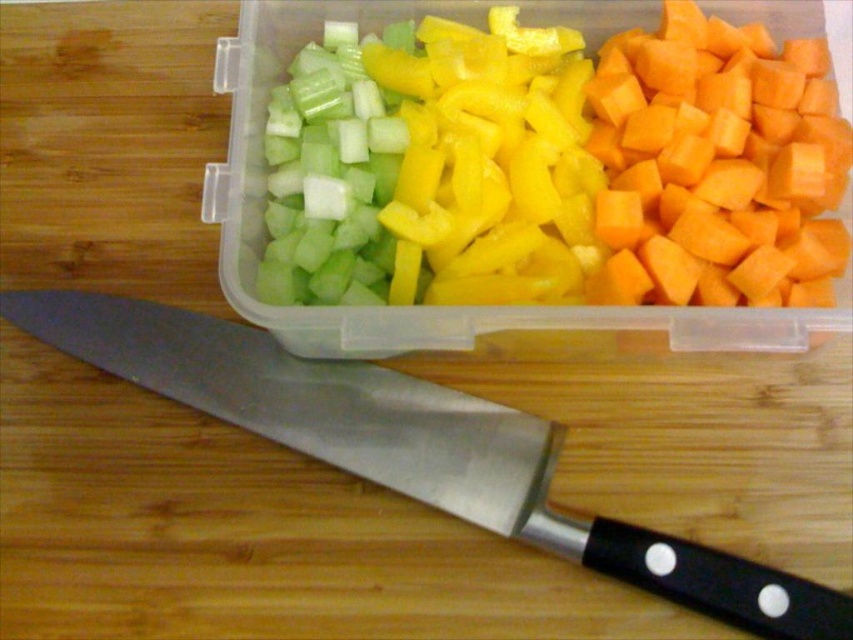
Question: Is orange matte carrot at right bigger than yellow matte bell pepper at center?

Choices:
 (A) no
 (B) yes

Answer: (B)

Question: Does polished metal knife at center appear over green translucent celery at upper left?

Choices:
 (A) no
 (B) yes

Answer: (A)

Question: Does polished metal knife at center have a larger size compared to yellow matte bell pepper at center?

Choices:
 (A) yes
 (B) no

Answer: (A)

Question: Among these points, which one is nearest to the camera?

Choices:
 (A) (631, 168)
 (B) (421, 381)
 (C) (461, 99)
 (D) (379, 128)

Answer: (A)

Question: Which of the following is the closest to the observer?

Choices:
 (A) orange matte carrot at right
 (B) yellow matte bell pepper at center
 (C) green translucent celery at upper left
 (D) polished metal knife at center

Answer: (D)

Question: Considering the real-world distances, which object is farthest from the yellow matte bell pepper at center?

Choices:
 (A) green translucent celery at upper left
 (B) polished metal knife at center
 (C) orange matte carrot at right

Answer: (B)